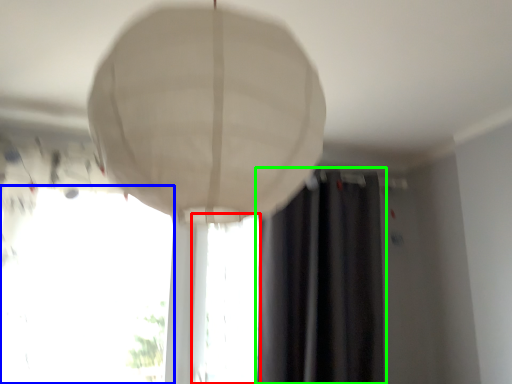
Question: Estimate the real-world distances between objects in this image. Which object is closer to window (highlighted by a red box), window (highlighted by a blue box) or curtain (highlighted by a green box)?

Choices:
 (A) window
 (B) curtain

Answer: (B)